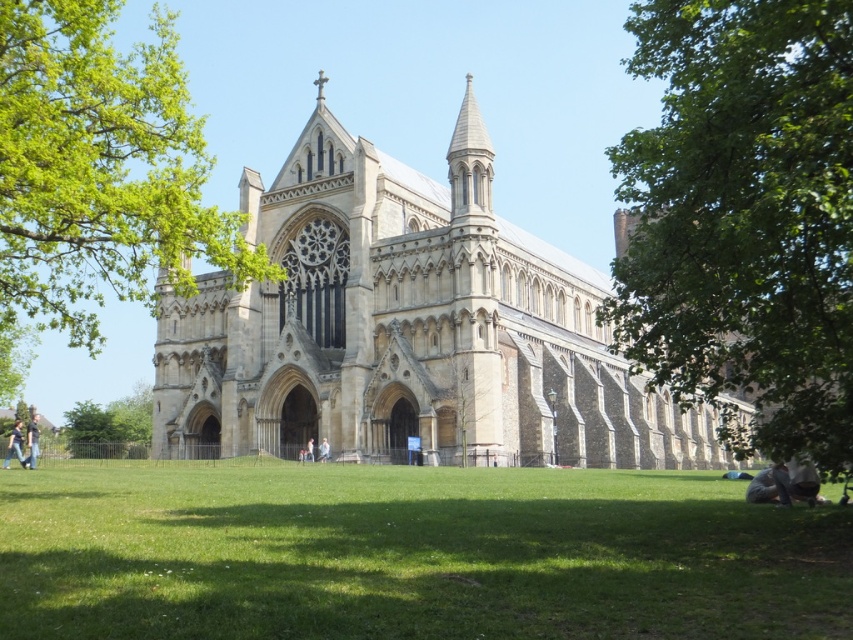
Question: Which point appears closest to the camera in this image?

Choices:
 (A) (64, 429)
 (B) (596, 317)
 (C) (16, 456)
 (D) (320, 452)

Answer: (B)

Question: Which of the following is the closest to the observer?

Choices:
 (A) (721, 164)
 (B) (35, 422)

Answer: (A)

Question: Can you confirm if stone church at center is bigger than green leafy tree at center?

Choices:
 (A) no
 (B) yes

Answer: (A)

Question: Which object is farther from the camera taking this photo?

Choices:
 (A) green leafy tree at lower left
 (B) green leafy tree at center

Answer: (A)

Question: Can you confirm if stone church at center is positioned below green leafy tree at center?

Choices:
 (A) no
 (B) yes

Answer: (B)

Question: Observing the image, what is the correct spatial positioning of green grass at center in reference to green leafy tree at lower right?

Choices:
 (A) below
 (B) above

Answer: (A)